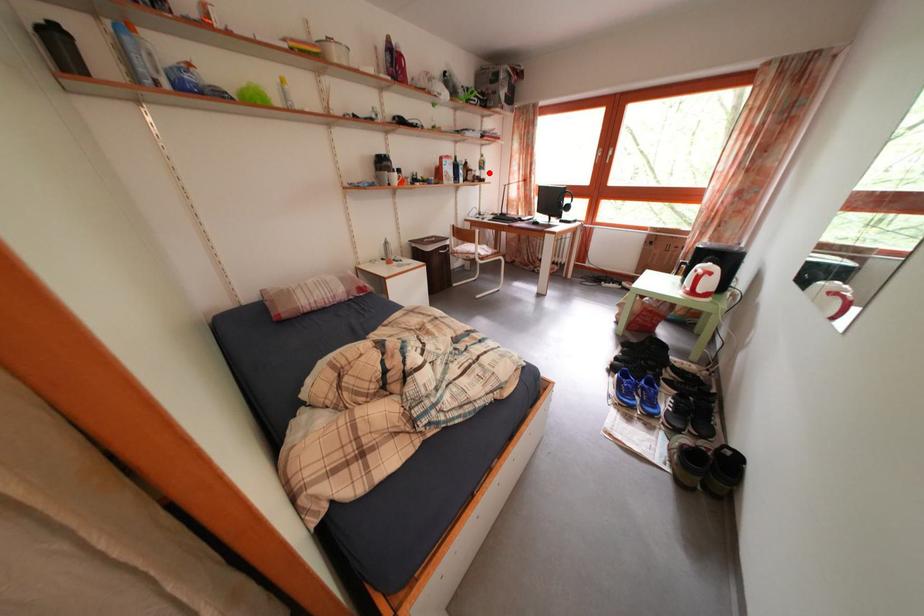
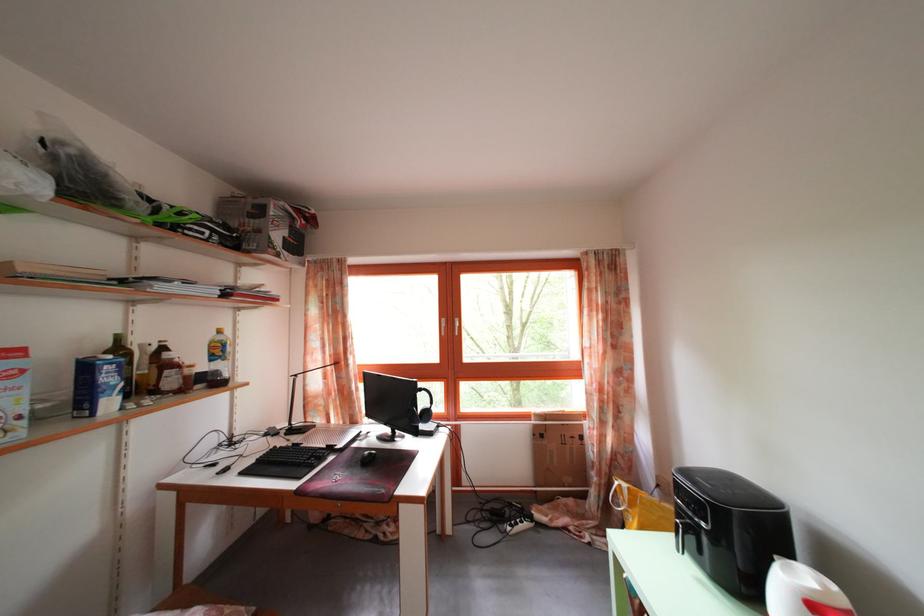
Question: A red point is marked in image1. In image2, is the corresponding 3D point closer to the camera or farther? Reply with the corresponding letter.

Choices:
 (A) The corresponding 3D point is closer.
 (B) The corresponding 3D point is farther.

Answer: (B)